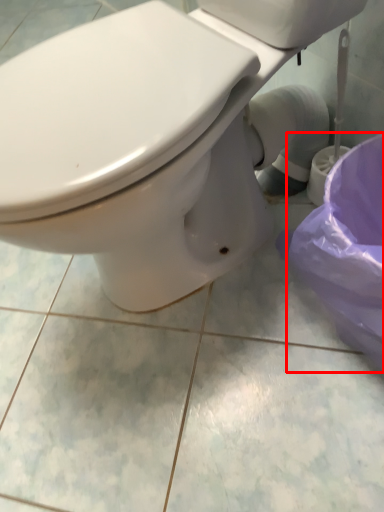
Question: From the image, what is the correct spatial relationship of potty (annotated by the red box) in relation to toilet?

Choices:
 (A) left
 (B) right

Answer: (B)